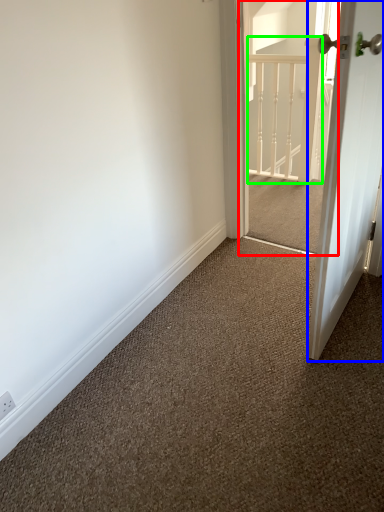
Question: Estimate the real-world distances between objects in this image. Which object is farther from screen door (highlighted by a red box), door (highlighted by a blue box) or rail (highlighted by a green box)?

Choices:
 (A) door
 (B) rail

Answer: (A)